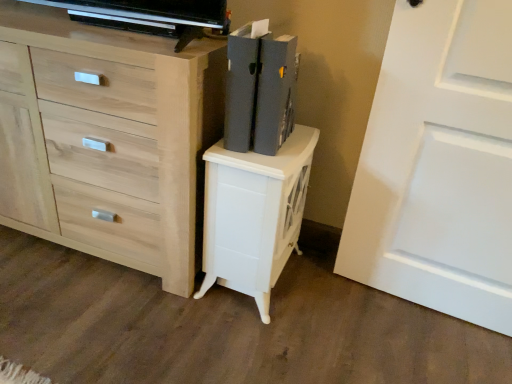
Question: From a real-world perspective, is white matte door at right physically located above or below matte gray book at upper right?

Choices:
 (A) above
 (B) below

Answer: (B)

Question: Considering the positions of white matte door at right and matte gray book at upper right in the image, is white matte door at right bigger or smaller than matte gray book at upper right?

Choices:
 (A) small
 (B) big

Answer: (B)

Question: Which object is positioned closest to the white glossy nightstand at center?

Choices:
 (A) white matte door at right
 (B) matte gray book at upper right
 (C) light wood chest of drawers at center

Answer: (B)

Question: Considering the real-world distances, which object is farthest from the white glossy nightstand at center?

Choices:
 (A) white matte door at right
 (B) matte gray book at upper right
 (C) light wood chest of drawers at center

Answer: (A)